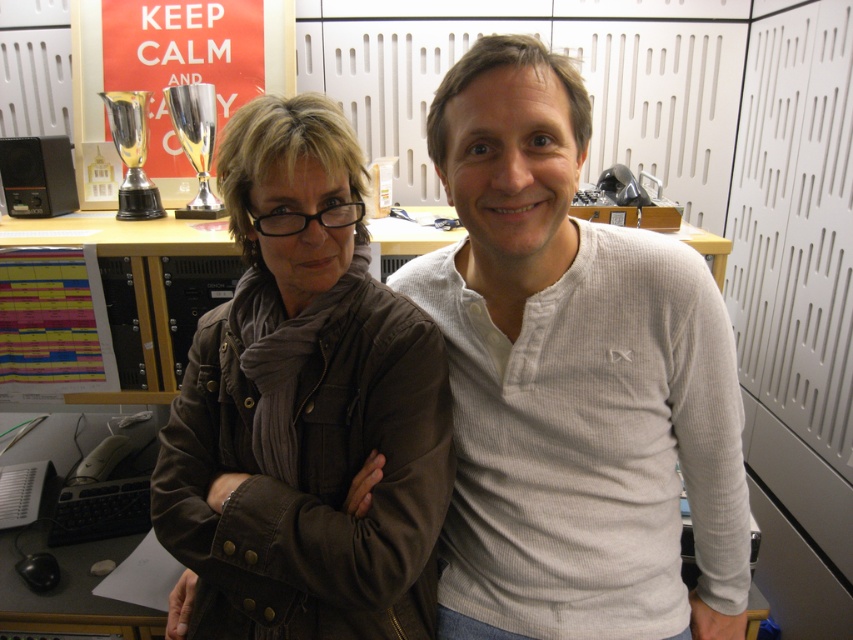
Question: Is white ribbed sweater at center to the left of brown leather jacket at center from the viewer's perspective?

Choices:
 (A) no
 (B) yes

Answer: (A)

Question: Can you confirm if white ribbed sweater at center is thinner than brown leather jacket at center?

Choices:
 (A) yes
 (B) no

Answer: (B)

Question: Is white ribbed sweater at center below brown leather jacket at center?

Choices:
 (A) yes
 (B) no

Answer: (B)

Question: Which point appears closest to the camera in this image?

Choices:
 (A) (618, 484)
 (B) (300, 515)

Answer: (B)

Question: Which point is farther from the camera taking this photo?

Choices:
 (A) (238, 291)
 (B) (665, 275)

Answer: (A)